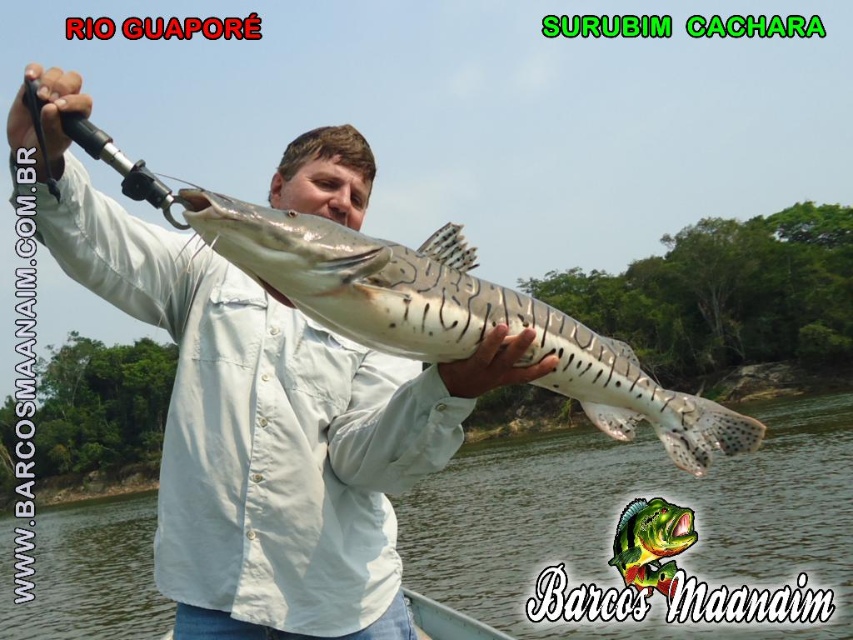
You are a photographer trying to capture the fish held by the person in the boat. Since the white matte shirt at center is covering part of the speckled skin fish at center, how can you adjust your camera angle to ensure the fish is fully visible?

The white matte shirt at center is positioned over the speckled skin fish at center. To fully capture the fish, you should angle the camera downward to avoid the shirt blocking the fish.

Consider the image. You are a photographer trying to capture the fisherman and his catch. You need to ensure both the white matte shirt at center and the speckled skin fish at center are clearly visible in the photo. Given their sizes, which object should you focus on first to ensure proper focus and framing?

The white matte shirt at center has a larger size compared to the speckled skin fish at center, so you should focus on the white matte shirt at center first to ensure proper focus and framing since it takes up more space in the composition.